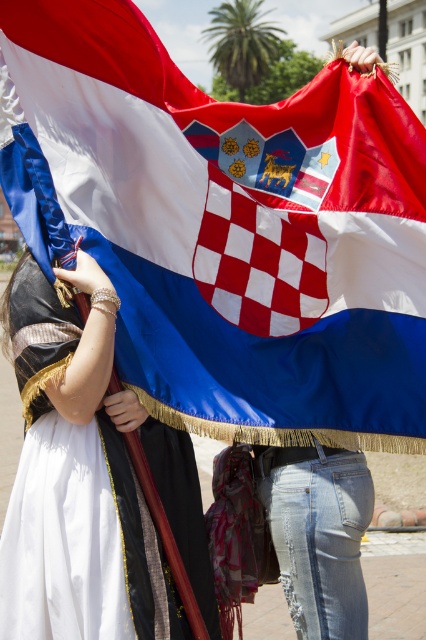
Question: Does silky fabric flag at center have a smaller size compared to matte black dress at left?

Choices:
 (A) no
 (B) yes

Answer: (A)

Question: Does silky fabric flag at center appear over matte black dress at left?

Choices:
 (A) no
 (B) yes

Answer: (B)

Question: Does silky fabric flag at center appear under matte black dress at left?

Choices:
 (A) yes
 (B) no

Answer: (B)

Question: Which point appears farthest from the camera in this image?

Choices:
 (A) (3, 582)
 (B) (184, 348)

Answer: (B)

Question: Which point is farther to the camera?

Choices:
 (A) silky fabric flag at center
 (B) matte black dress at left

Answer: (A)